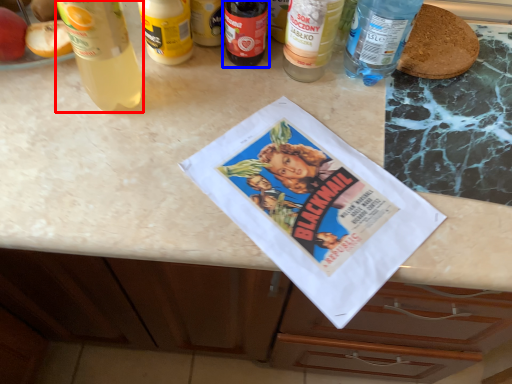
Question: Which point is closer to the camera, bottle (highlighted by a red box) or bottle (highlighted by a blue box)?

Choices:
 (A) bottle
 (B) bottle

Answer: (A)